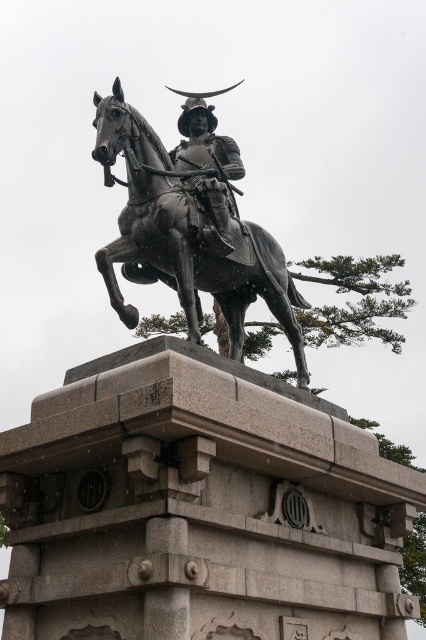
Does shiny black horse at center appear on the right side of polished bronze helmet at center?

Yes, shiny black horse at center is to the right of polished bronze helmet at center.

The width and height of the screenshot is (426, 640). What do you see at coordinates (189, 228) in the screenshot?
I see `shiny black horse at center` at bounding box center [189, 228].

Is point (120, 256) positioned after point (207, 115)?

No, (120, 256) is in front of (207, 115).

At what (x,y) coordinates should I click in order to perform the action: click on shiny black horse at center. Please return your answer as a coordinate pair (x, y). The height and width of the screenshot is (640, 426). Looking at the image, I should click on (189, 228).